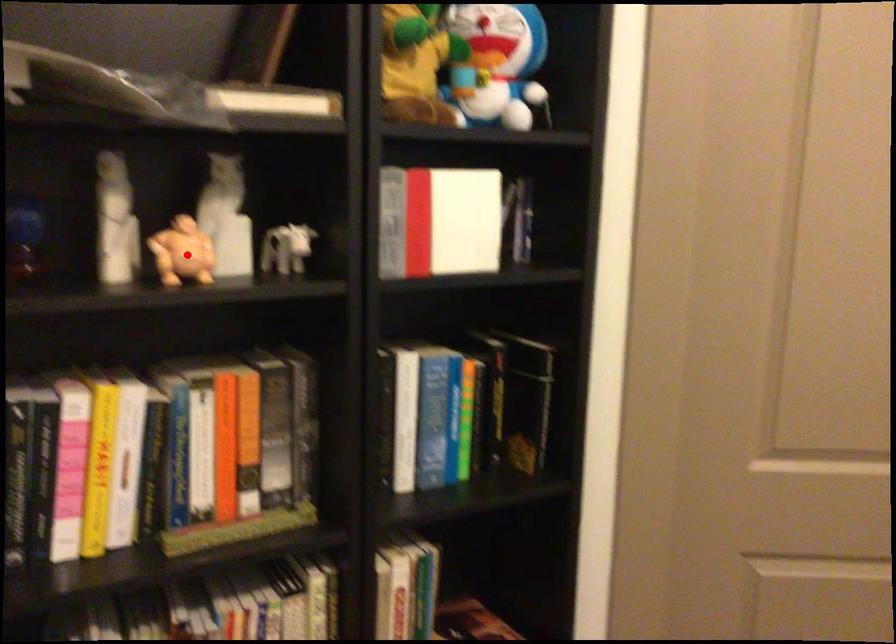
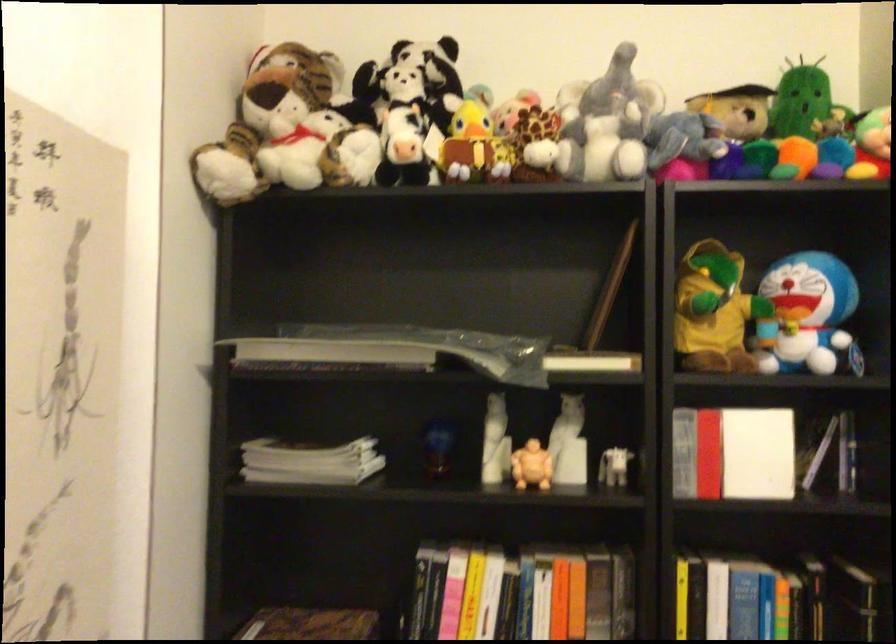
Question: A red point is marked in image1. In image2, is the corresponding 3D point closer to the camera or farther? Reply with the corresponding letter.

Choices:
 (A) The corresponding 3D point is closer.
 (B) The corresponding 3D point is farther.

Answer: (B)